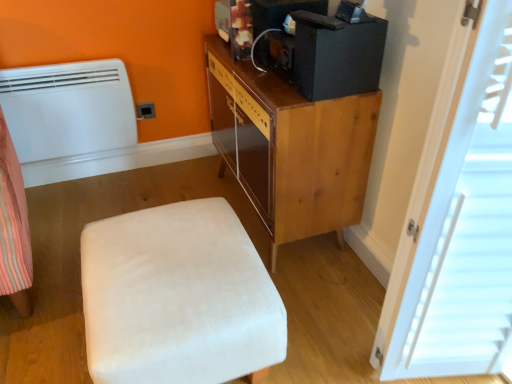
Locate an element on the screen. This screenshot has width=512, height=384. free space to the left of wooden cabinet at upper right is located at coordinates (141, 196).